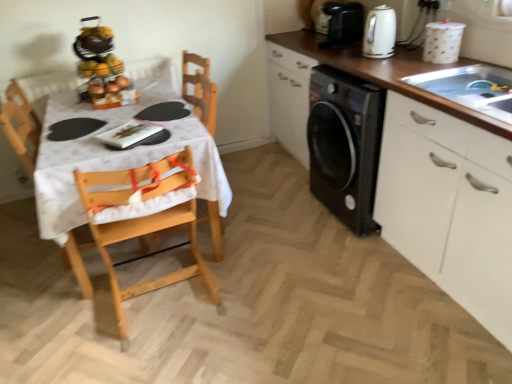
I want to click on empty space that is in between white fabric tablecloth at left and wooden highchair at left, so click(x=165, y=301).